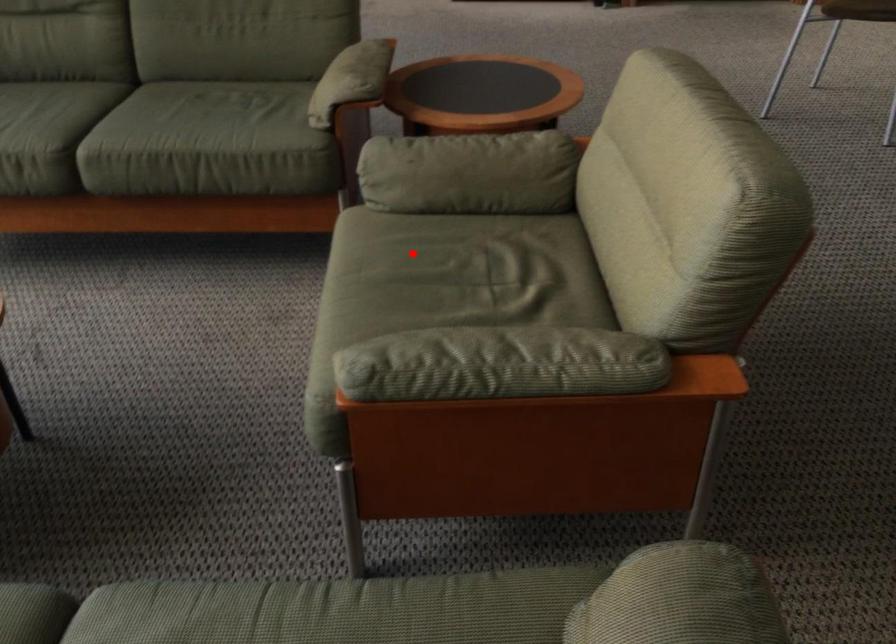
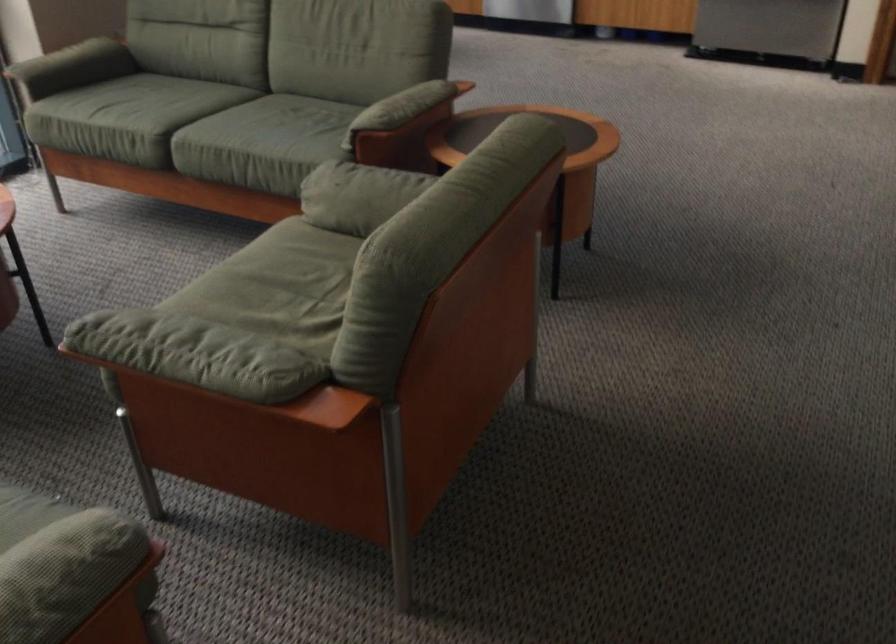
The point at the highlighted location is marked in the first image. Where is the corresponding point in the second image?

(289, 260)